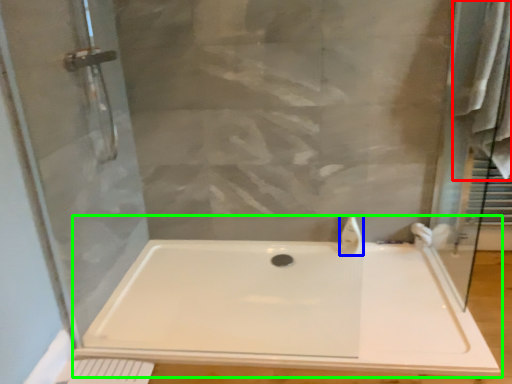
Question: Estimate the real-world distances between objects in this image. Which object is closer to bath towel (highlighted by a red box), faucet (highlighted by a blue box) or bathtub (highlighted by a green box)?

Choices:
 (A) faucet
 (B) bathtub

Answer: (A)